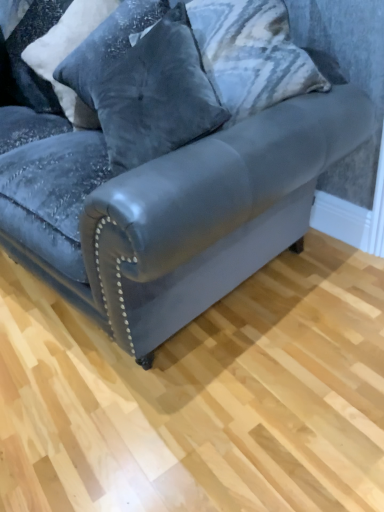
Question: In the image, is velvet pillow at upper left, which appears as the 2th pillow when viewed from the right, positioned in front of or behind velvet dark blue couch at center?

Choices:
 (A) front
 (B) behind

Answer: (B)

Question: Is point (89, 121) closer or farther from the camera than point (150, 207)?

Choices:
 (A) farther
 (B) closer

Answer: (A)

Question: Based on their relative distances, which object is nearer to the velvet gray pillow at upper center, placed as the 1th pillow when sorted from right to left?

Choices:
 (A) velvet dark blue couch at center
 (B) velvet pillow at upper left, which appears as the 2th pillow when viewed from the right
 (C) velvet dark gray pillow at upper left, which is the third pillow in right-to-left order
 (D) velvet dark blue pillow at upper left, placed as the 1th pillow when sorted from left to right

Answer: (B)

Question: Which is farther from the velvet dark blue pillow at upper left, the 4th pillow when ordered from right to left?

Choices:
 (A) velvet dark gray pillow at upper left, which ranks as the 2th pillow in left-to-right order
 (B) velvet gray pillow at upper center, which appears as the 4th pillow when viewed from the left
 (C) velvet pillow at upper left, positioned as the third pillow in left-to-right order
 (D) velvet dark blue couch at center

Answer: (B)